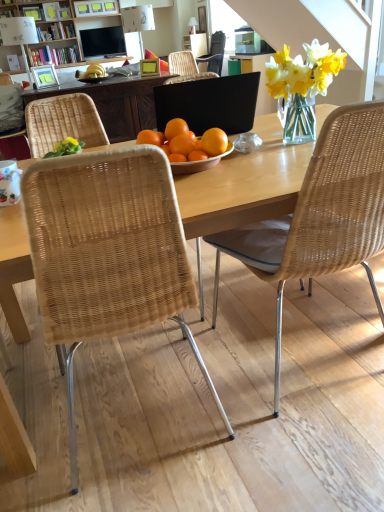
Question: From the image's perspective, is woven wicker chair at center, arranged as the first chair when viewed from the right, positioned above or below matte wood picture frame at upper left, which is the first picture frame from left to right?

Choices:
 (A) below
 (B) above

Answer: (A)

Question: In terms of height, does woven wicker chair at center, the third chair from the left, look taller or shorter compared to matte wood picture frame at upper left, which is the first picture frame from left to right?

Choices:
 (A) tall
 (B) short

Answer: (A)

Question: Which of these objects is positioned farthest from the wooden table at center?

Choices:
 (A) matte green picture frame at upper center, the 2th picture frame positioned from the left
 (B) woven rattan chair at left, placed as the 1th chair when sorted from back to front
 (C) matte black television at upper center
 (D) woven wicker chair at center, the second chair positioned from the front
 (E) woven wicker chair at center, acting as the third chair starting from the back

Answer: (C)

Question: Which object is positioned closest to the black matte laptop at center?

Choices:
 (A) wooden bookcase at upper center
 (B) wooden table at center
 (C) matte black television at upper center
 (D) matte wood picture frame at upper left, which ranks as the second picture frame in right-to-left order
 (E) woven wicker chair at center, positioned as the 2th chair in left-to-right order

Answer: (B)